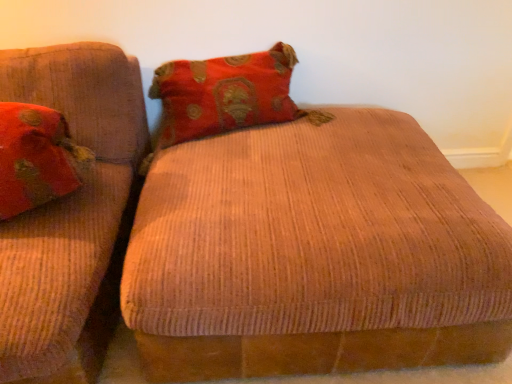
The height and width of the screenshot is (384, 512). I want to click on corduroy fabric ottoman at center, so click(306, 240).

The width and height of the screenshot is (512, 384). Describe the element at coordinates (306, 240) in the screenshot. I see `corduroy fabric ottoman at center` at that location.

What are the coordinates of `matte red pillow at left` in the screenshot? It's located at (36, 158).

What do you see at coordinates (36, 158) in the screenshot?
I see `matte red pillow at left` at bounding box center [36, 158].

Where is `corduroy fabric ottoman at center`? The width and height of the screenshot is (512, 384). corduroy fabric ottoman at center is located at coordinates (306, 240).

Considering the positions of objects matte red pillow at left and corduroy fabric ottoman at center in the image provided, who is more to the left, matte red pillow at left or corduroy fabric ottoman at center?

From the viewer's perspective, matte red pillow at left appears more on the left side.

Is the position of matte red pillow at left less distant than that of corduroy fabric ottoman at center?

No, the depth of matte red pillow at left is greater than that of corduroy fabric ottoman at center.

Does point (63, 188) come closer to viewer compared to point (254, 57)?

Yes, it is in front of point (254, 57).

From the image's perspective, is matte red pillow at left on top of corduroy fabric ottoman at center?

Yes, from the image's perspective, matte red pillow at left is on top of corduroy fabric ottoman at center.

Consider the image. From a real-world perspective, who is located lower, matte red pillow at left or corduroy fabric ottoman at center?

corduroy fabric ottoman at center, from a real-world perspective.

Which of these two, matte red pillow at left or corduroy fabric ottoman at center, is thinner?

matte red pillow at left.

Which of these two, matte red pillow at left or corduroy fabric ottoman at center, stands shorter?

matte red pillow at left.

Does matte red pillow at left have a smaller size compared to corduroy fabric ottoman at center?

Yes, matte red pillow at left is smaller than corduroy fabric ottoman at center.

Is matte red pillow at left located outside corduroy fabric ottoman at center?

matte red pillow at left lies outside corduroy fabric ottoman at center's area.

Are matte red pillow at left and corduroy fabric ottoman at center making contact?

No, matte red pillow at left is not making contact with corduroy fabric ottoman at center.

Is matte red pillow at left facing towards corduroy fabric ottoman at center?

No, matte red pillow at left is not facing towards corduroy fabric ottoman at center.

In order to click on studio couch that is below the matte red pillow at left (from the image's perspective) in this screenshot , I will do `click(306, 240)`.

Is corduroy fabric ottoman at center to the left or to the right of matte red pillow at left in the image?

corduroy fabric ottoman at center is positioned on matte red pillow at left's right side.

Considering their positions, is corduroy fabric ottoman at center located in front of or behind matte red pillow at left?

corduroy fabric ottoman at center is in front of matte red pillow at left.

Is point (160, 137) positioned in front of point (1, 129)?

No, it is not.

From the image's perspective, is corduroy fabric ottoman at center on matte red pillow at left?

No.

In the scene shown: From a real-world perspective, relative to matte red pillow at left, is corduroy fabric ottoman at center vertically above or below?

From a real-world perspective, corduroy fabric ottoman at center is physically below matte red pillow at left.

Considering the sizes of objects corduroy fabric ottoman at center and matte red pillow at left in the image provided, who is thinner, corduroy fabric ottoman at center or matte red pillow at left?

matte red pillow at left is thinner.

Does corduroy fabric ottoman at center have a greater height compared to matte red pillow at left?

Correct, corduroy fabric ottoman at center is much taller as matte red pillow at left.

From the picture: Is corduroy fabric ottoman at center bigger than matte red pillow at left?

Yes.

Is corduroy fabric ottoman at center surrounding matte red pillow at left?

That's incorrect, matte red pillow at left is not inside corduroy fabric ottoman at center.

Are corduroy fabric ottoman at center and matte red pillow at left making contact?

No, corduroy fabric ottoman at center is not touching matte red pillow at left.

Is corduroy fabric ottoman at center aimed at matte red pillow at left?

No, corduroy fabric ottoman at center is not turned towards matte red pillow at left.

What's the angular difference between corduroy fabric ottoman at center and matte red pillow at left's facing directions?

They differ by 20.3 degrees in their facing directions.

Find the location of `pillow lying above the corduroy fabric ottoman at center (from the image's perspective)`. pillow lying above the corduroy fabric ottoman at center (from the image's perspective) is located at coordinates (36, 158).

Identify the location of pillow lying on the left of corduroy fabric ottoman at center. pyautogui.click(x=36, y=158).

Where is `studio couch that appears on the right of matte red pillow at left`? This screenshot has height=384, width=512. studio couch that appears on the right of matte red pillow at left is located at coordinates (306, 240).